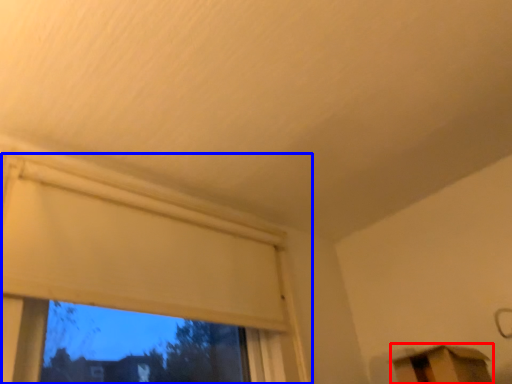
Question: Which of the following is the closest to the observer, furniture (highlighted by a red box) or window (highlighted by a blue box)?

Choices:
 (A) furniture
 (B) window

Answer: (B)